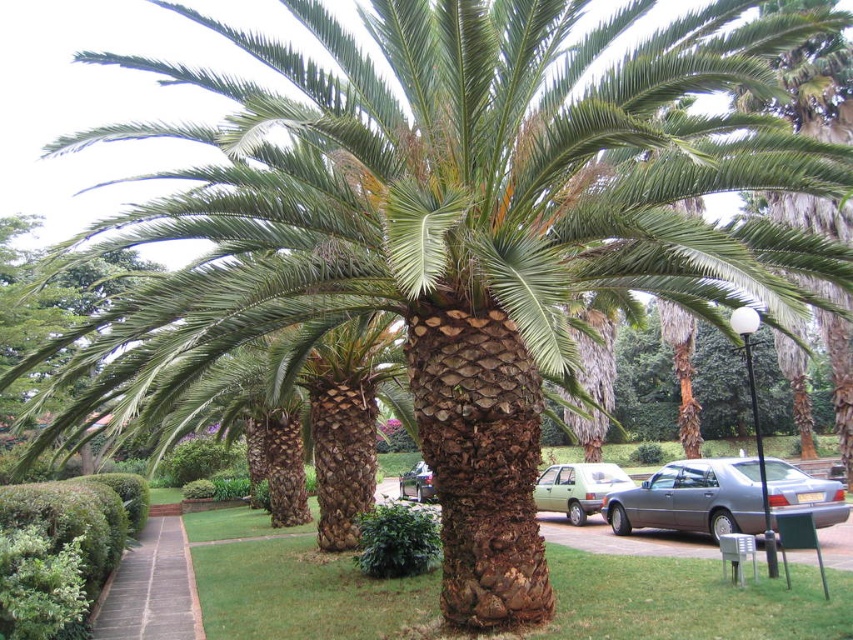
Question: Which of these objects is positioned farthest from the brown brick pavement at lower left?

Choices:
 (A) green leafy hedge at center
 (B) metallic gray sedan at center
 (C) metallic silver sedan at center
 (D) green leafy hedge at lower left

Answer: (B)

Question: Which object is positioned farthest from the green leafy hedge at center?

Choices:
 (A) green matte sedan at center
 (B) green leafy hedge at lower left
 (C) metallic gray sedan at center

Answer: (C)

Question: Is green leafy hedge at lower left to the right of green matte sedan at center from the viewer's perspective?

Choices:
 (A) no
 (B) yes

Answer: (A)

Question: Is brown brick pavement at lower left positioned at the back of green leafy hedge at center?

Choices:
 (A) yes
 (B) no

Answer: (B)

Question: Can you confirm if green leafy hedge at lower left is positioned below green matte sedan at center?

Choices:
 (A) no
 (B) yes

Answer: (A)

Question: Which of the following is the closest to the observer?

Choices:
 (A) (434, 540)
 (B) (431, 481)
 (C) (689, 492)
 (D) (119, 596)

Answer: (D)